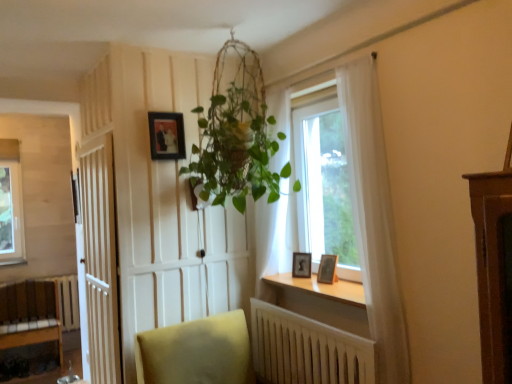
Question: Is matte black frame at upper center, the first picture frame viewed from the top, in front of or behind wooden radiator at lower center in the image?

Choices:
 (A) behind
 (B) front

Answer: (A)

Question: Considering the positions of matte black frame at upper center, the first picture frame viewed from the top, and wooden radiator at lower center in the image, is matte black frame at upper center, the first picture frame viewed from the top, wider or thinner than wooden radiator at lower center?

Choices:
 (A) wide
 (B) thin

Answer: (B)

Question: Which object is the farthest from the matte black frame at upper center, arranged as the first picture frame when viewed from the left?

Choices:
 (A) wooden bench at lower left
 (B) wooden photo frame at window sill, which appears as the 1th picture frame when ordered from the bottom
 (C) white wooden door at left
 (D) wooden at lower center
 (E) transparent glass window at center

Answer: (A)

Question: Estimate the real-world distances between objects in this image. Which object is farther from the wooden photo frame at window, the second picture frame positioned from the top?

Choices:
 (A) wooden at lower center
 (B) wooden radiator at lower center
 (C) wooden photo frame at window sill, the 3th picture frame positioned from the top
 (D) white wooden door at left
 (E) wooden bench at lower left

Answer: (E)